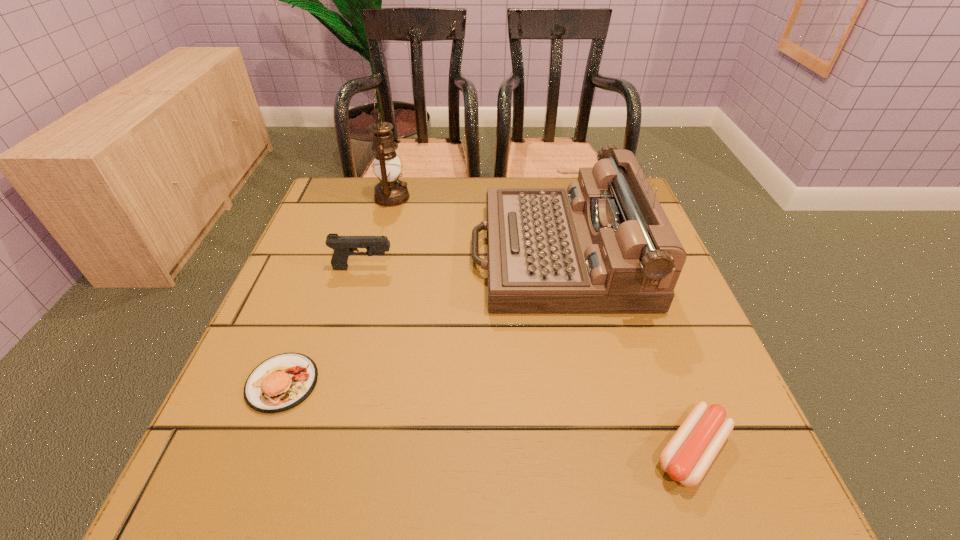
Locate an element on the screen. Image resolution: width=960 pixels, height=540 pixels. free space that satisfies the following two spatial constraints: 1. on the keyboard of the shortest object; 2. on the right side of the second tallest object is located at coordinates (596, 451).

Where is `vacant space that satisfies the following two spatial constraints: 1. at the barrel of the third shortest object; 2. on the right side of the sausage`? The image size is (960, 540). vacant space that satisfies the following two spatial constraints: 1. at the barrel of the third shortest object; 2. on the right side of the sausage is located at coordinates (310, 451).

Locate an element on the screen. This screenshot has width=960, height=540. free space that satisfies the following two spatial constraints: 1. on the front side of the patty; 2. on the left side of the shortest object is located at coordinates (256, 451).

Image resolution: width=960 pixels, height=540 pixels. I want to click on vacant area in the image that satisfies the following two spatial constraints: 1. on the front side of the fourth tallest object; 2. on the left side of the sausage, so click(256, 451).

The width and height of the screenshot is (960, 540). I want to click on vacant space that satisfies the following two spatial constraints: 1. on the keyboard of the shortest object; 2. on the right side of the typewriter, so 596,451.

Where is `free space that satisfies the following two spatial constraints: 1. on the back side of the sausage; 2. at the barrel of the third tallest object`? The height and width of the screenshot is (540, 960). free space that satisfies the following two spatial constraints: 1. on the back side of the sausage; 2. at the barrel of the third tallest object is located at coordinates (626, 268).

Where is `vacant space that satisfies the following two spatial constraints: 1. on the front side of the sausage; 2. on the right side of the fourth tallest object`? This screenshot has width=960, height=540. vacant space that satisfies the following two spatial constraints: 1. on the front side of the sausage; 2. on the right side of the fourth tallest object is located at coordinates (256, 451).